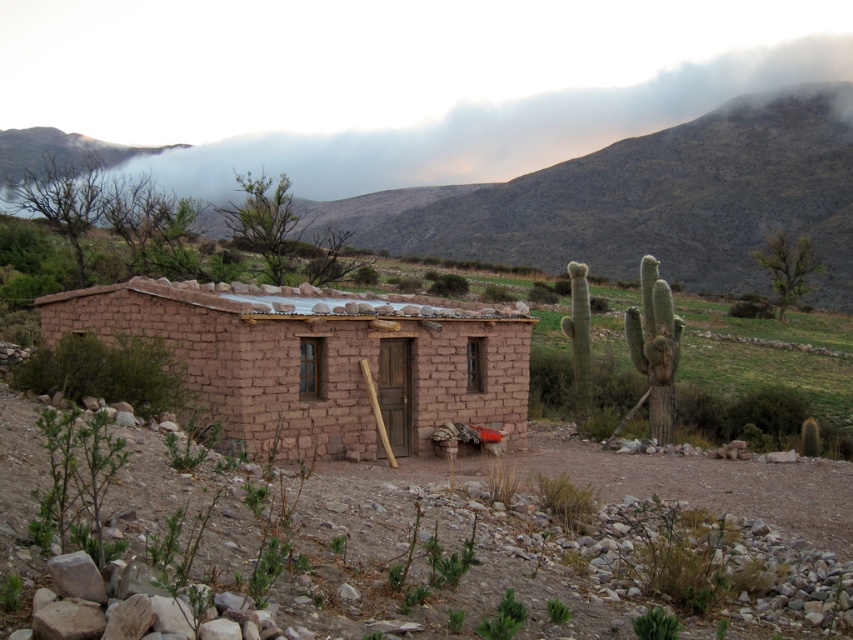
Question: Can you confirm if brown adobe hut at center is positioned below smooth gray rock formation at upper left?

Choices:
 (A) no
 (B) yes

Answer: (B)

Question: Is brown adobe hut at center in front of smooth gray rock formation at upper left?

Choices:
 (A) yes
 (B) no

Answer: (A)

Question: Can you confirm if brown adobe hut at center is positioned to the right of smooth gray rock formation at upper left?

Choices:
 (A) yes
 (B) no

Answer: (A)